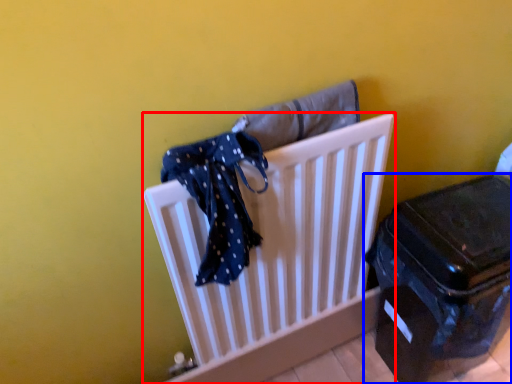
Question: Which of the following is the farthest to the observer, furniture (highlighted by a red box) or suitcase (highlighted by a blue box)?

Choices:
 (A) furniture
 (B) suitcase

Answer: (B)